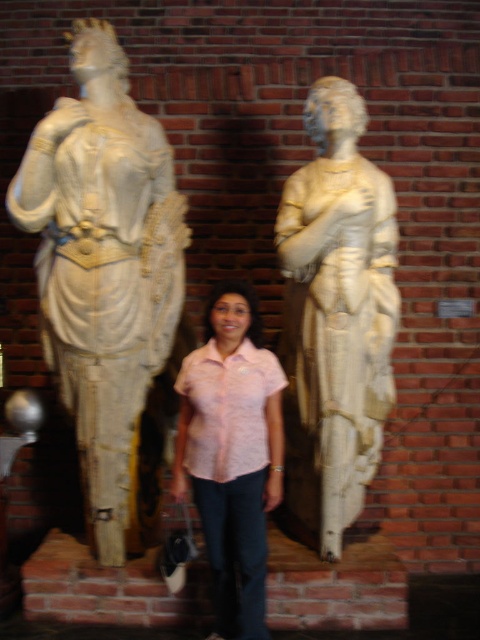
You are a photographer trying to capture a clear shot of the pink floral shirt at center without the white marble statue at left blocking the view. Based on the scene, is this possible?

The pink floral shirt at center is behind the white marble statue at left, so it would be blocked from view unless you move around the statue.

You are standing in front of the statues and want to take a photo of the white marble statue at left and the pink floral shirt at center. Which object is located to the left of the other?

The white marble statue at left is positioned on the left side of the pink floral shirt at center.